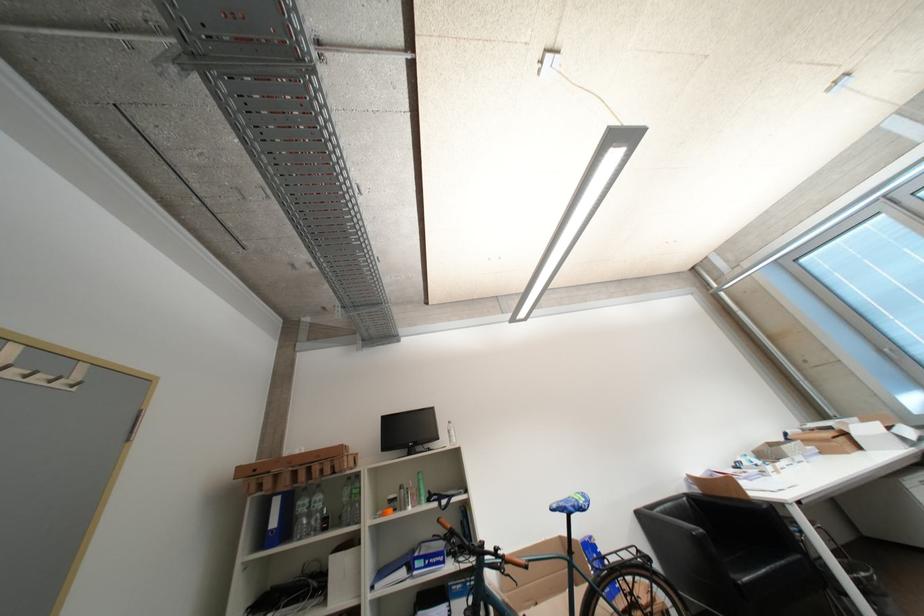
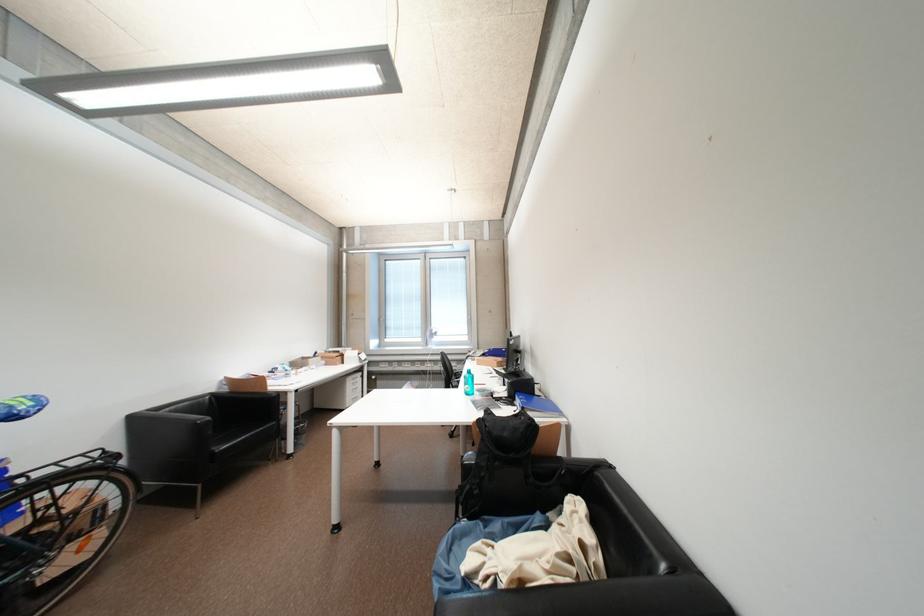
The point at (743, 498) is marked in the first image. Where is the corresponding point in the second image?

(264, 392)